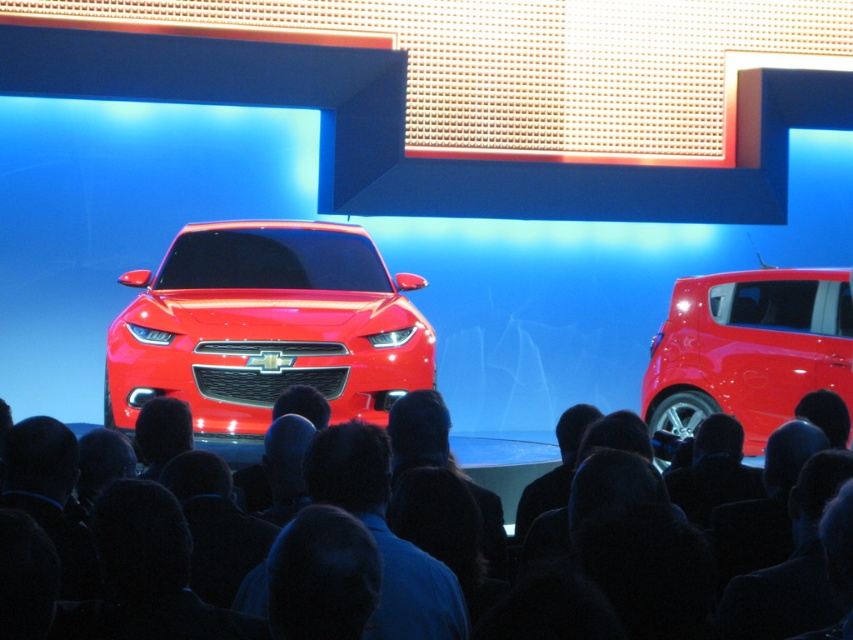
Question: Which object is the closest to the glossy red car at center?

Choices:
 (A) black hair at center
 (B) glossy metallic car at center

Answer: (B)

Question: Does black hair at center come in front of glossy red car at center?

Choices:
 (A) no
 (B) yes

Answer: (B)

Question: Is black hair at center to the right of glossy red car at center from the viewer's perspective?

Choices:
 (A) yes
 (B) no

Answer: (B)

Question: Does black hair at center have a smaller size compared to glossy red car at center?

Choices:
 (A) no
 (B) yes

Answer: (B)

Question: Which point is farther to the camera?

Choices:
 (A) glossy metallic car at center
 (B) black hair at center
 (C) glossy red car at center

Answer: (C)

Question: Which of the following is the farthest from the observer?

Choices:
 (A) glossy red car at center
 (B) glossy metallic car at center

Answer: (A)